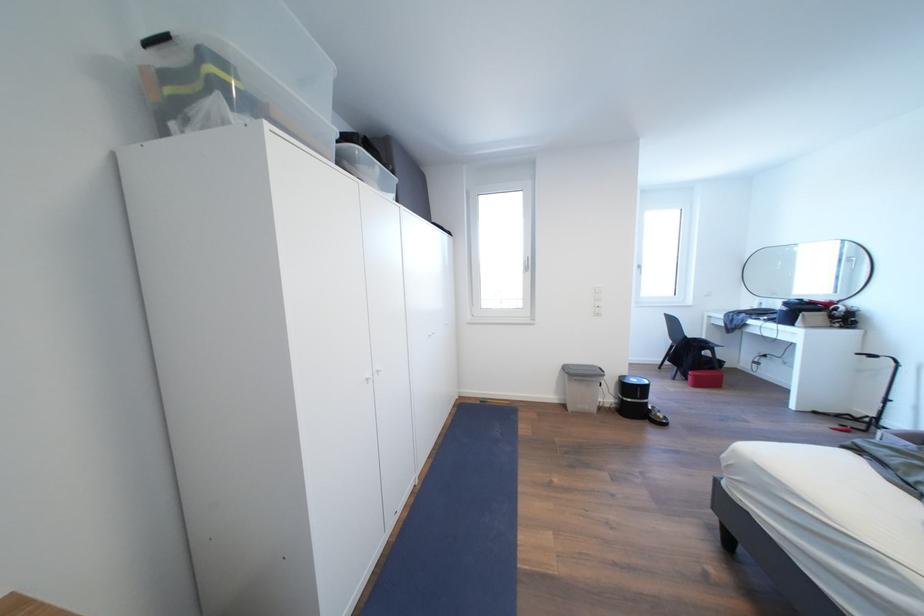
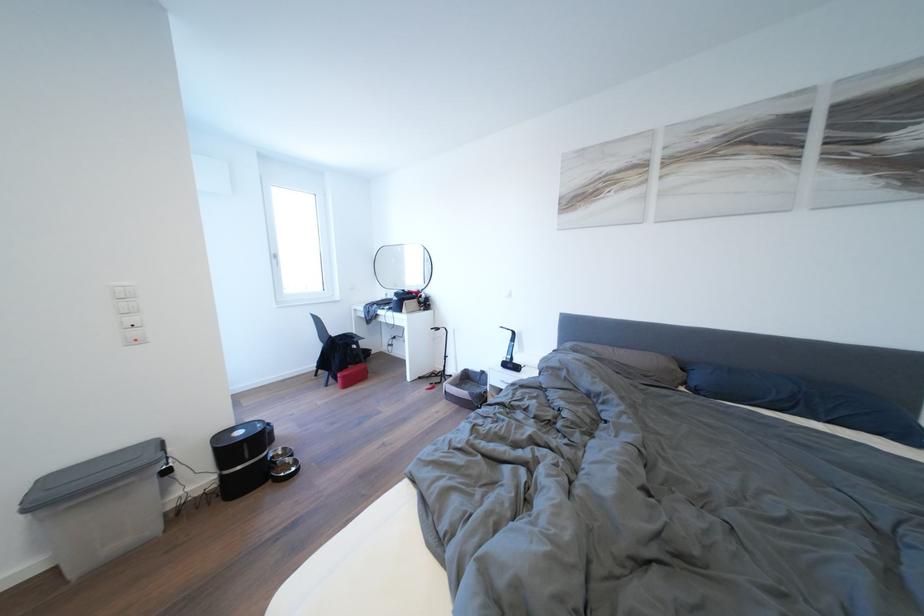
Where in the second image is the point corresponding to point (699, 375) from the first image?

(348, 376)